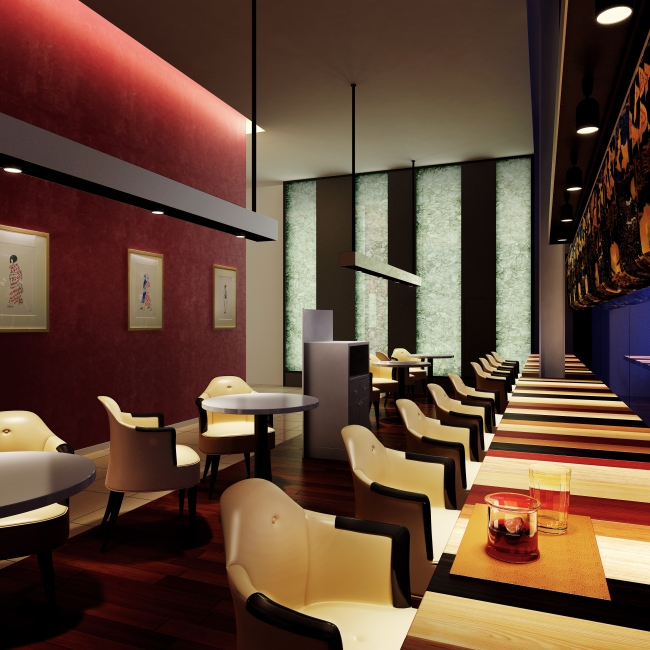
Locate an element on the screen. This screenshot has height=650, width=650. cord is located at coordinates (350, 124), (411, 177), (253, 127).